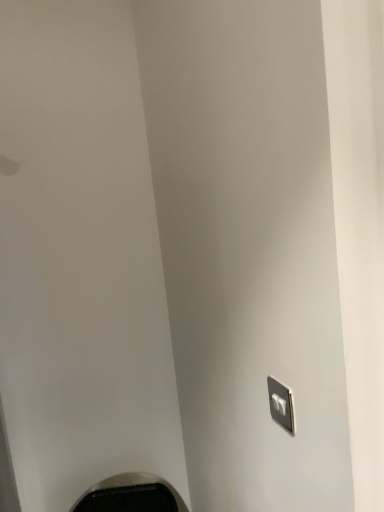
At what (x,y) coordinates should I click in order to perform the action: click on satin silver switch at lower right. Please return your answer as a coordinate pair (x, y). The height and width of the screenshot is (512, 384). Looking at the image, I should click on (281, 404).

Describe the element at coordinates (281, 404) in the screenshot. I see `satin silver switch at lower right` at that location.

Image resolution: width=384 pixels, height=512 pixels. What are the coordinates of `satin silver switch at lower right` in the screenshot? It's located at (281, 404).